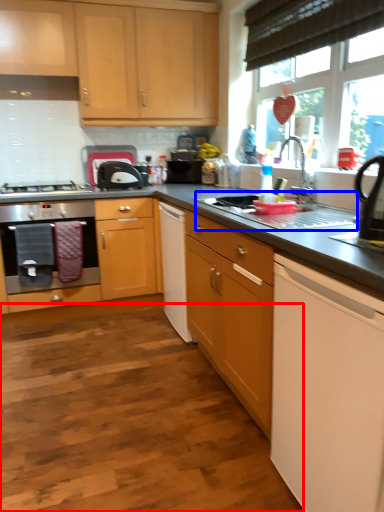
Question: Which of the following is the closest to the observer, plain (highlighted by a red box) or sink (highlighted by a blue box)?

Choices:
 (A) plain
 (B) sink

Answer: (A)